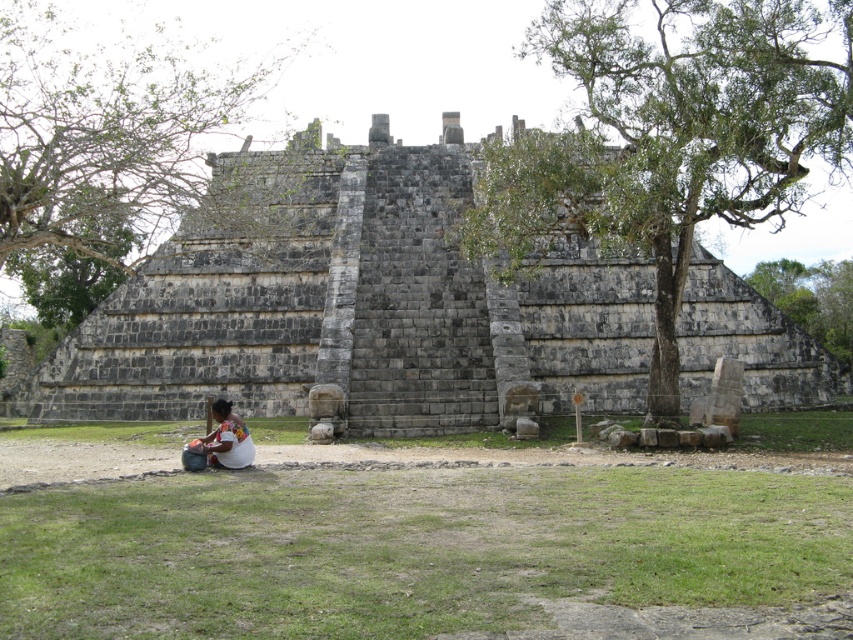
Question: Which object is positioned farthest from the green grass at lower center?

Choices:
 (A) gray stone ruins at center
 (B) multicolored fabric at lower left

Answer: (A)

Question: Does green grass at lower center have a smaller size compared to multicolored fabric at lower left?

Choices:
 (A) no
 (B) yes

Answer: (A)

Question: Which object is closer to the camera taking this photo?

Choices:
 (A) multicolored fabric at lower left
 (B) green grass at lower center

Answer: (B)

Question: Is gray stone ruins at center bigger than multicolored fabric at lower left?

Choices:
 (A) no
 (B) yes

Answer: (B)

Question: Is green grass at lower center to the left of multicolored fabric at lower left from the viewer's perspective?

Choices:
 (A) yes
 (B) no

Answer: (B)

Question: Which point appears farthest from the camera in this image?

Choices:
 (A) (242, 461)
 (B) (198, 531)
 (C) (178, 248)

Answer: (C)